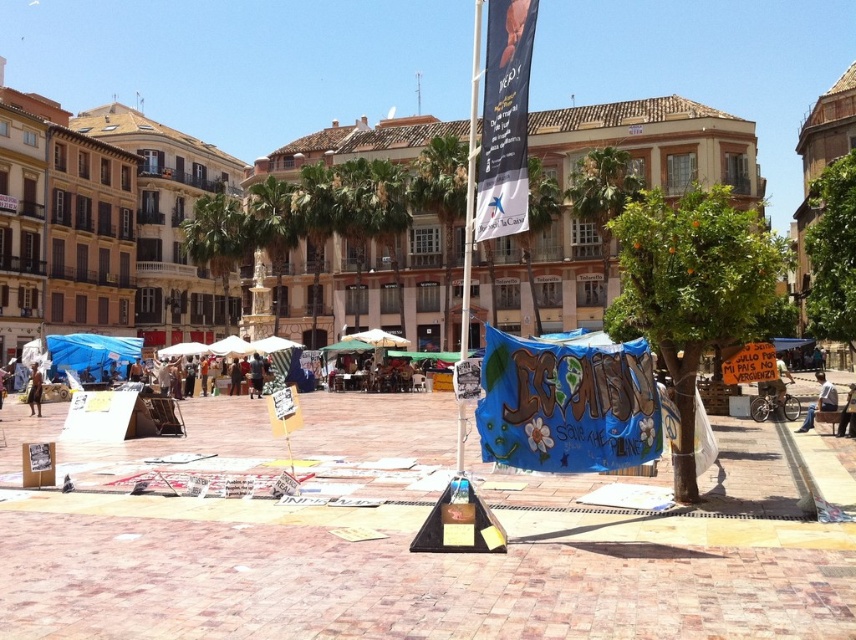
Can you confirm if blue fabric banner at center is smaller than white fabric banner at center?

Actually, blue fabric banner at center might be larger than white fabric banner at center.

You are a GUI agent. You are given a task and a screenshot of the screen. Output one action in this format:
    pyautogui.click(x=<x>, y=<y>)
    Task: Click on the blue fabric banner at center
    Image resolution: width=856 pixels, height=640 pixels.
    Given the screenshot: What is the action you would take?
    pyautogui.click(x=568, y=404)

Is white fabric banner at center wider than dark brown skin at lower left?

No, white fabric banner at center is not wider than dark brown skin at lower left.

Is point (486, 212) behind point (39, 380)?

No, it is not.

The height and width of the screenshot is (640, 856). I want to click on white fabric banner at center, so click(504, 120).

Is white fabric banner at center further to the viewer compared to brown fabric tent at center?

No, it is in front of brown fabric tent at center.

Which is above, white fabric banner at center or brown fabric tent at center?

white fabric banner at center

Is point (526, 122) positioned behind point (158, 369)?

That is False.

Image resolution: width=856 pixels, height=640 pixels. Identify the location of white fabric banner at center. (504, 120).